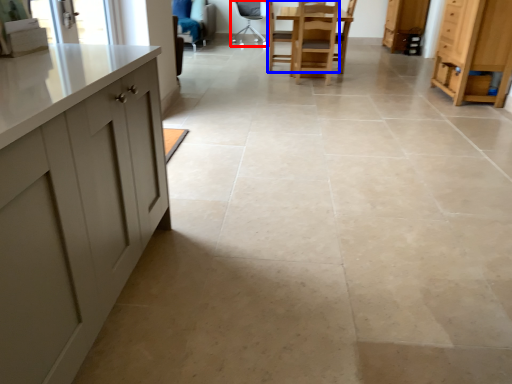
Question: Which of the following is the closest to the observer, chair (highlighted by a red box) or chair (highlighted by a blue box)?

Choices:
 (A) chair
 (B) chair

Answer: (B)